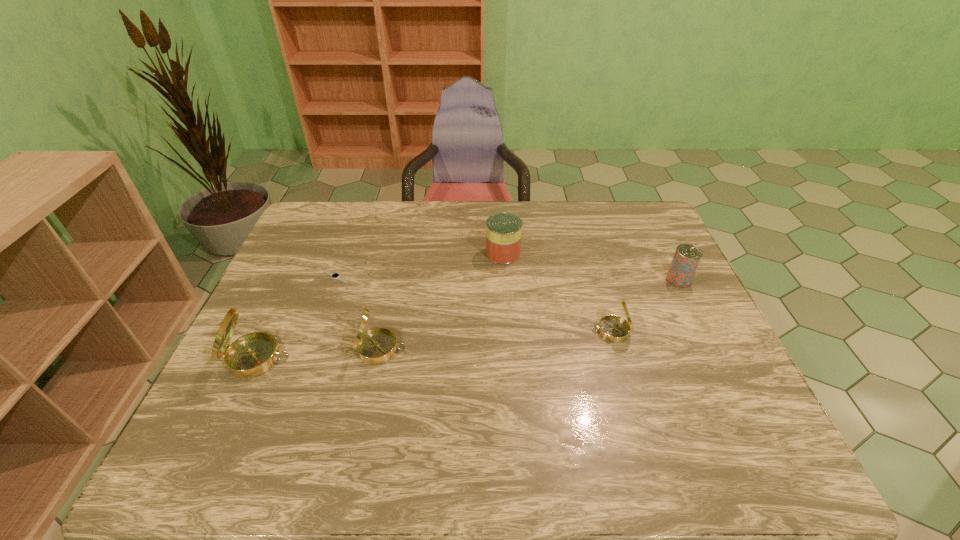
Identify the location of watch that is positioned at the left edge. (336, 276).

Find the location of `object that is at the right edge`. object that is at the right edge is located at coordinates (686, 258).

Image resolution: width=960 pixels, height=540 pixels. Identify the location of free region at the far edge. (593, 215).

Locate an element on the screen. The width and height of the screenshot is (960, 540). vacant space at the left edge of the desktop is located at coordinates (267, 325).

In the image, there is a desktop. Where is `vacant space at the right edge`? The image size is (960, 540). vacant space at the right edge is located at coordinates (643, 302).

I want to click on vacant space at the far left corner of the desktop, so click(x=293, y=238).

Where is `free space at the near left corner of the desktop`? The image size is (960, 540). free space at the near left corner of the desktop is located at coordinates (246, 402).

The image size is (960, 540). In order to click on free location at the far right corner of the desktop in this screenshot , I will do `click(648, 228)`.

This screenshot has height=540, width=960. I want to click on unoccupied position between the beer can and the rightmost compass, so click(x=645, y=305).

Locate an element on the screen. The width and height of the screenshot is (960, 540). vacant point located between the leftmost object and the second compass from left to right is located at coordinates (319, 353).